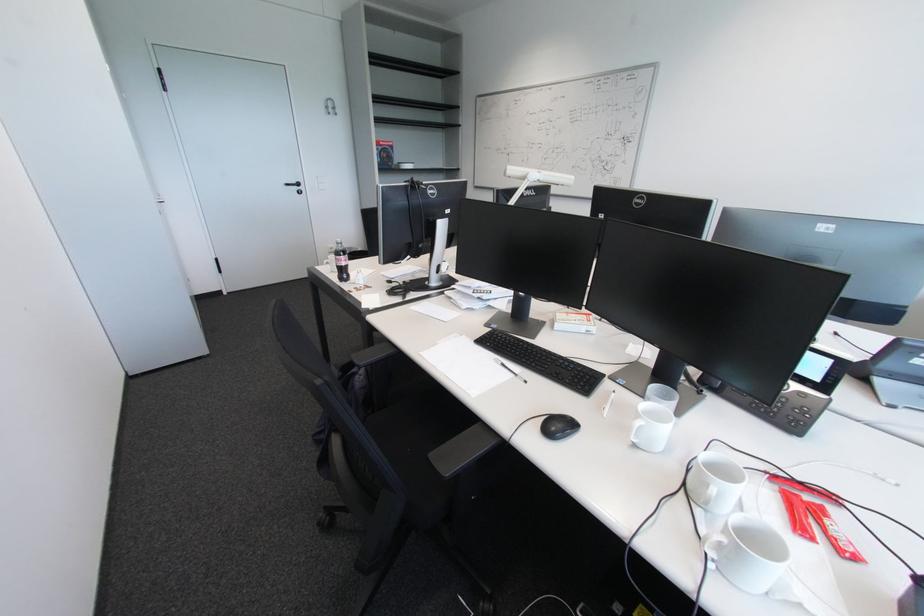
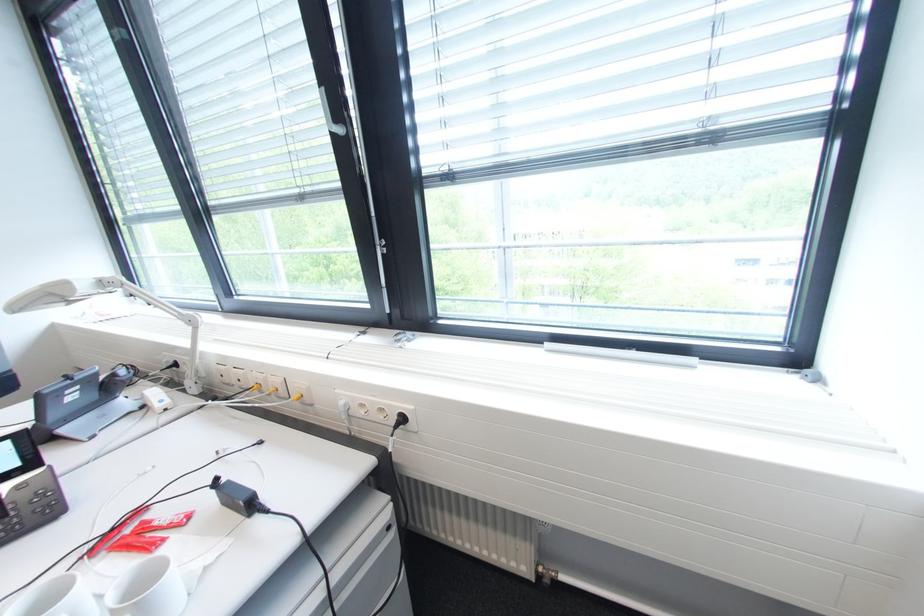
The images are taken continuously from a first-person perspective. In which direction is your viewpoint rotating?

The camera rotated toward right-down.